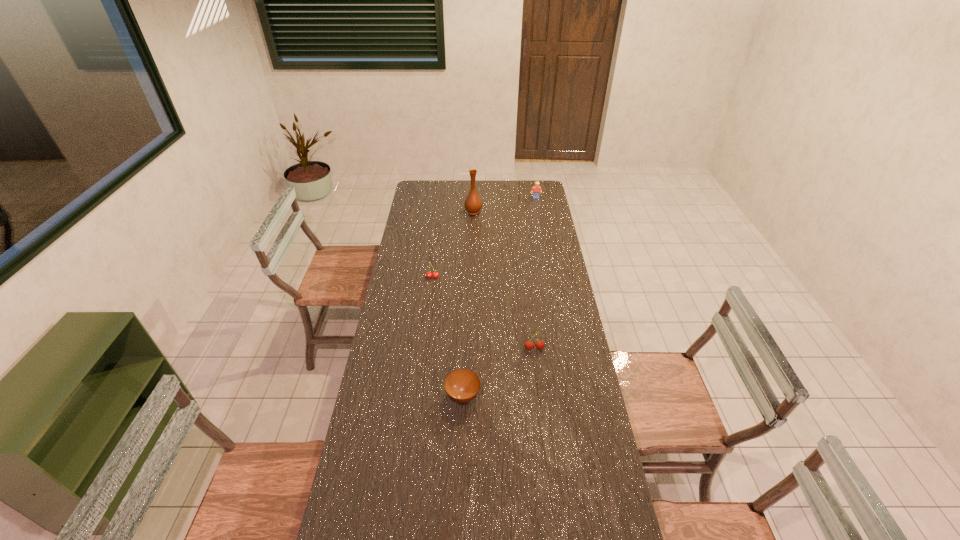
Identify the location of free point between the right cherry and the bowl. The image size is (960, 540). (498, 372).

The height and width of the screenshot is (540, 960). I want to click on object that is the nearest to the farther cherry, so click(x=473, y=204).

At what (x,y) coordinates should I click in order to perform the action: click on object that is the second closest to the left cherry. Please return your answer as a coordinate pair (x, y). Looking at the image, I should click on (529, 345).

Locate an element on the screen. This screenshot has width=960, height=540. free spot that satisfies the following two spatial constraints: 1. on the back side of the bowl; 2. on the left side of the fourth nearest object is located at coordinates (469, 212).